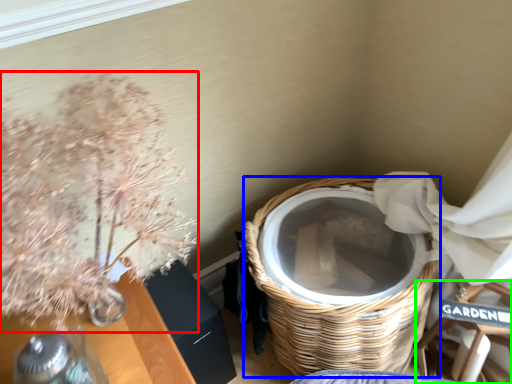
Question: Estimate the real-world distances between objects in this image. Which object is closer to floral arrangement (highlighted by a red box), basket (highlighted by a blue box) or armchair (highlighted by a green box)?

Choices:
 (A) basket
 (B) armchair

Answer: (A)